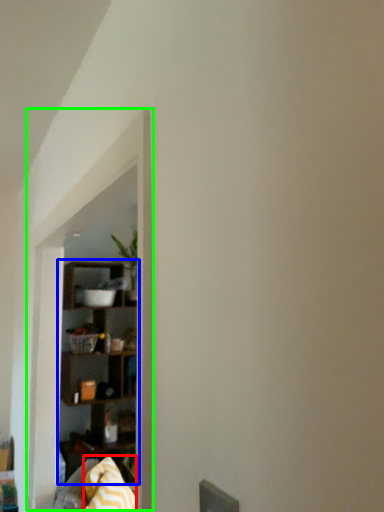
Question: Which object is positioned farthest from blanket (highlighted by a red box)? Select from shelf (highlighted by a blue box) and window sill (highlighted by a green box).

Choices:
 (A) shelf
 (B) window sill

Answer: (A)